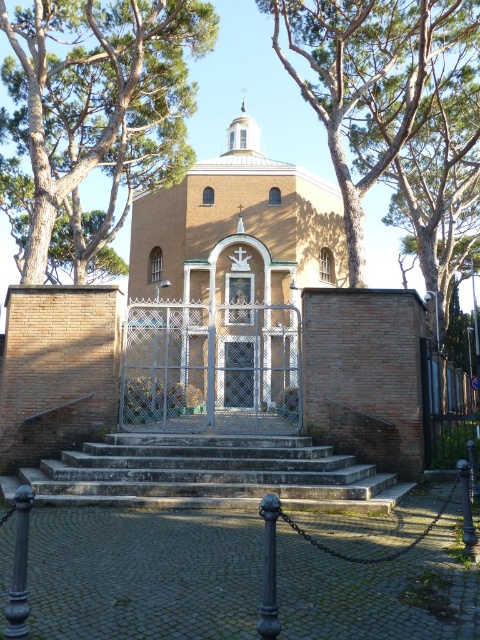
Question: Among these objects, which one is nearest to the camera?

Choices:
 (A) beige brick church at center
 (B) brown textured tree at upper center
 (C) green leafy tree at upper center

Answer: (C)

Question: Which object appears closest to the camera in this image?

Choices:
 (A) brown textured tree at upper center
 (B) stone steps at center
 (C) beige brick church at center

Answer: (B)

Question: Does brown brick church at center appear on the left side of green leafy tree at upper center?

Choices:
 (A) no
 (B) yes

Answer: (A)

Question: Is brown brick church at center above stone steps at center?

Choices:
 (A) yes
 (B) no

Answer: (A)

Question: Does green leafy tree at upper center have a smaller size compared to beige brick church at center?

Choices:
 (A) yes
 (B) no

Answer: (B)

Question: Among these objects, which one is nearest to the camera?

Choices:
 (A) stone steps at center
 (B) beige brick church at center
 (C) brown textured tree at upper center
 (D) green leafy tree at upper center

Answer: (A)